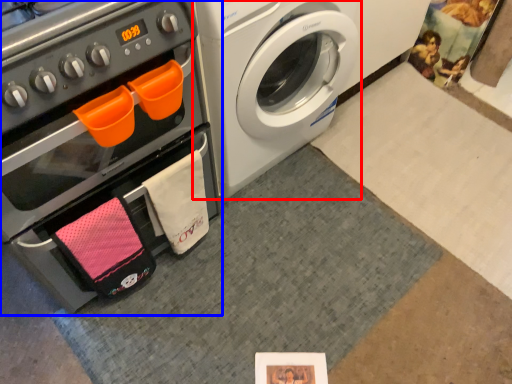
Question: Which of the following is the closest to the observer, washing machine (highlighted by a red box) or oven (highlighted by a blue box)?

Choices:
 (A) washing machine
 (B) oven

Answer: (B)